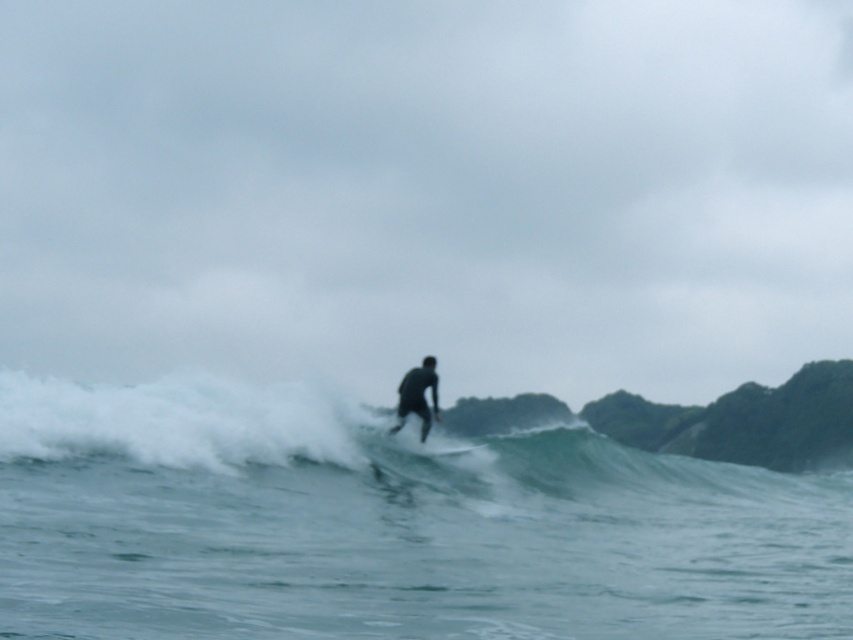
Question: Can you confirm if greenish-blue water at center is positioned to the left of white foam surfboard at center?

Choices:
 (A) yes
 (B) no

Answer: (B)

Question: Which object is closer to the camera taking this photo?

Choices:
 (A) greenish-blue water at center
 (B) white foam surfboard at center
 (C) black matte surfboard at center

Answer: (A)

Question: Does greenish-blue water at center appear over black matte surfboard at center?

Choices:
 (A) no
 (B) yes

Answer: (A)

Question: Among these points, which one is nearest to the camera?

Choices:
 (A) (438, 449)
 (B) (332, 595)
 (C) (409, 392)

Answer: (B)

Question: Is greenish-blue water at center below white foam surfboard at center?

Choices:
 (A) no
 (B) yes

Answer: (B)

Question: Which point is farther to the camera?

Choices:
 (A) greenish-blue water at center
 (B) black matte surfboard at center

Answer: (B)